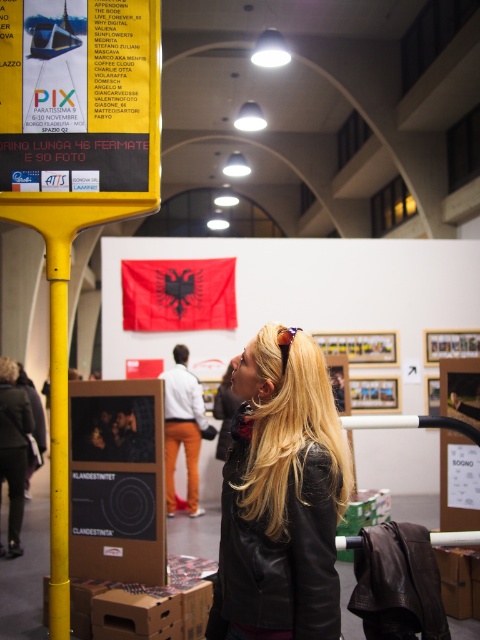
You are an architect designing a new exhibition layout. You need to place a new information kiosk at point 0.7, 0.12. The existing yellow matte pole at left is at point (59, 444). Will the new kiosk be placed directly to the right of the yellow matte pole at left?

The new kiosk at point 0.7, 0.12 is very close to the yellow matte pole at left at point (59, 444), but since the x coordinate of the kiosk is slightly higher than the pole, it will be placed directly to the right of the yellow matte pole at left.